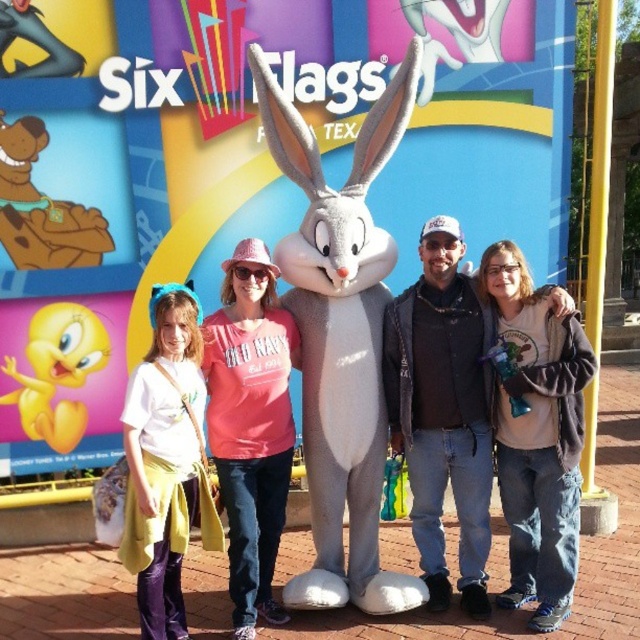
Consider the image. Does white plush rabbit at center have a larger size compared to yellow fabric headband at left?

Indeed, white plush rabbit at center has a larger size compared to yellow fabric headband at left.

Is point (394, 129) farther from viewer compared to point (188, 316)?

Yes.

Where is `white plush rabbit at center`? white plush rabbit at center is located at coordinates (340, 340).

Who is positioned more to the left, brown fuzzy jacket at lower right or pink fabric shirt at center?

pink fabric shirt at center is more to the left.

Between point (509, 323) and point (243, 387), which one is positioned in front?

Positioned in front is point (243, 387).

Does point (513, 464) come behind point (250, 310)?

That is True.

Identify the location of brown fuzzy jacket at lower right. (536, 433).

Between point (292, 323) and point (157, 538), which one is positioned in front?

Point (157, 538)

Based on the photo, is pink fabric shirt at center thinner than yellow fabric headband at left?

No.

Is point (234, 292) less distant than point (140, 589)?

No.

Identify the location of pink fabric shirt at center. Image resolution: width=640 pixels, height=640 pixels. (250, 424).